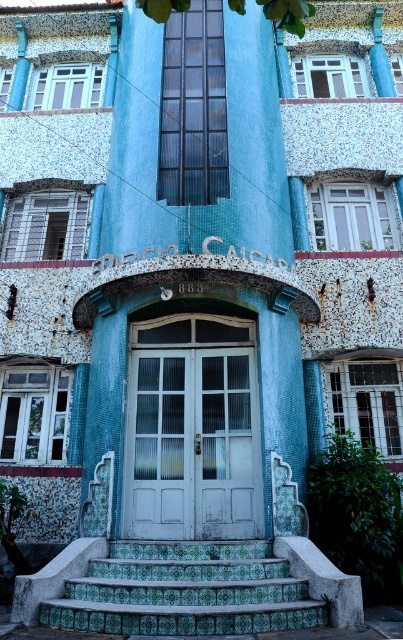
You are a delivery person trying to enter the EDIFICIO CAICAR. You see the white matte door at center and the green tile stairs at center. Which one should you approach to enter the building?

The white matte door at center is larger in size than the green tile stairs at center, so you should approach the white matte door at center to enter the building.

You are standing outside the entrance of the building and want to go down the stairs. The white matte door at center is closed. Can you see the green tile stairs at center from your current position?

The green tile stairs at center is behind the white matte door at center, so you cannot see the green tile stairs at center from outside the building when the door is closed.